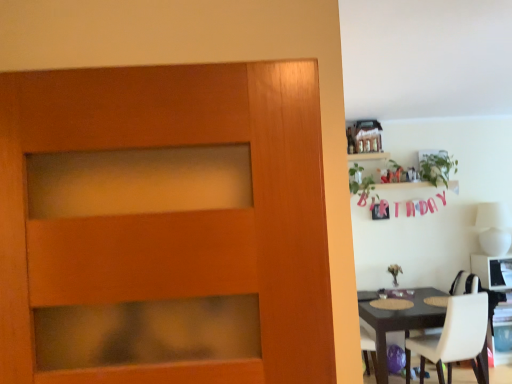
This screenshot has height=384, width=512. Describe the element at coordinates (360, 184) in the screenshot. I see `green leafy plant at upper right, which is the first plant in left-to-right order` at that location.

Where is `green leafy plant at upper right, which is counted as the first plant, starting from the right`? Image resolution: width=512 pixels, height=384 pixels. green leafy plant at upper right, which is counted as the first plant, starting from the right is located at coordinates (437, 168).

At what (x,y) coordinates should I click in order to perform the action: click on computer desk located underneath the green leafy plant at upper right, which is the 2th plant from left to right (from a real-world perspective). Please return your answer as a coordinate pair (x, y). Looking at the image, I should click on (501, 303).

Considering the sizes of objects green leafy plant at upper right, which is counted as the first plant, starting from the right, and white glossy computer desk at right in the image provided, who is thinner, green leafy plant at upper right, which is counted as the first plant, starting from the right, or white glossy computer desk at right?

green leafy plant at upper right, which is counted as the first plant, starting from the right.

Could white glossy computer desk at right be considered to be inside green leafy plant at upper right, which is counted as the first plant, starting from the right?

That's incorrect, white glossy computer desk at right is not inside green leafy plant at upper right, which is counted as the first plant, starting from the right.

Considering the points (454, 168) and (482, 263), which point is in front, point (454, 168) or point (482, 263)?

The point (482, 263) is in front.

Considering the points (438, 308) and (366, 183), which point is in front, point (438, 308) or point (366, 183)?

The point (438, 308) is closer to the camera.

Can you confirm if matte brown table at right is wider than green leafy plant at upper right, positioned as the 2th plant in right-to-left order?

Yes, matte brown table at right is wider than green leafy plant at upper right, positioned as the 2th plant in right-to-left order.

Where is `round table on the right side of green leafy plant at upper right, which is the first plant in left-to-right order`? The width and height of the screenshot is (512, 384). round table on the right side of green leafy plant at upper right, which is the first plant in left-to-right order is located at coordinates (401, 322).

Is matte brown table at right smaller than green leafy plant at upper right, which is the first plant in left-to-right order?

No.

Is point (504, 357) positioned in front of point (447, 343)?

No, it is behind (447, 343).

Does white glossy computer desk at right lie behind white leather chair at lower right?

Yes, the depth of white glossy computer desk at right is greater than that of white leather chair at lower right.

Considering the positions of objects white glossy computer desk at right and white leather chair at lower right in the image provided, who is more to the right, white glossy computer desk at right or white leather chair at lower right?

Positioned to the right is white glossy computer desk at right.

What are the coordinates of `computer desk above the white leather chair at lower right (from a real-world perspective)` in the screenshot? It's located at (501, 303).

This screenshot has height=384, width=512. Find the location of `chair that appears in front of the wooden shelf at upper right`. chair that appears in front of the wooden shelf at upper right is located at coordinates (454, 337).

Is white leather chair at lower right aimed at wooden shelf at upper right?

No, white leather chair at lower right does not turn towards wooden shelf at upper right.

Does white leather chair at lower right come behind wooden shelf at upper right?

No, white leather chair at lower right is closer to the camera.

Can you tell me how much white leather chair at lower right and wooden shelf at upper right differ in facing direction?

The facing directions of white leather chair at lower right and wooden shelf at upper right are 171 degrees apart.

Is wooden shelf at upper right positioned behind white glossy computer desk at right?

No, wooden shelf at upper right is closer to the viewer.

Which of these two, wooden shelf at upper right or white glossy computer desk at right, stands shorter?

wooden shelf at upper right.

From the image's perspective, which one is positioned higher, wooden shelf at upper right or white glossy computer desk at right?

wooden shelf at upper right.

From the image's perspective, would you say white leather chair at lower right is shown under green leafy plant at upper right, which is the first plant in left-to-right order?

Yes, from the image's perspective, white leather chair at lower right is below green leafy plant at upper right, which is the first plant in left-to-right order.

Could you measure the distance between white leather chair at lower right and green leafy plant at upper right, which is the first plant in left-to-right order?

white leather chair at lower right is 1.46 meters from green leafy plant at upper right, which is the first plant in left-to-right order.

Which of these two, white leather chair at lower right or green leafy plant at upper right, positioned as the 2th plant in right-to-left order, stands taller?

white leather chair at lower right.

Looking at this image, is white leather chair at lower right beside green leafy plant at upper right, which is the first plant in left-to-right order?

No.

Is white glossy computer desk at right beside wooden shelf at upper right?

No.

Considering the points (502, 317) and (382, 154), which point is in front, point (502, 317) or point (382, 154)?

The point (502, 317) is closer to the camera.

Which object is closer to the camera, white glossy computer desk at right or wooden shelf at upper right?

Positioned in front is wooden shelf at upper right.

Based on the photo, from a real-world perspective, is white glossy computer desk at right located higher than wooden shelf at upper right?

Incorrect, from a real-world perspective, white glossy computer desk at right is lower than wooden shelf at upper right.

From the image's perspective, which plant is the 2nd one above the white glossy computer desk at right? Please provide its 2D coordinates.

[(437, 168)]

In order to click on the 1st plant directly above the matte brown table at right (from a real-world perspective) in this screenshot , I will do `click(360, 184)`.

Looking at the image, which one is located closer to green leafy plant at upper right, which is counted as the first plant, starting from the right, white glossy computer desk at right or matte brown table at right?

white glossy computer desk at right is positioned closer to the anchor green leafy plant at upper right, which is counted as the first plant, starting from the right.

Looking at the image, which one is located closer to matte brown table at right, wooden shelf at upper right or green leafy plant at upper right, which is counted as the first plant, starting from the right?

green leafy plant at upper right, which is counted as the first plant, starting from the right.

Considering their positions, is green leafy plant at upper right, which is the first plant in left-to-right order, positioned further to green leafy plant at upper right, which is the 2th plant from left to right, than matte brown table at right?

Among the two, matte brown table at right is located further to green leafy plant at upper right, which is the 2th plant from left to right.

Considering their positions, is matte brown table at right positioned closer to green leafy plant at upper right, which is the first plant in left-to-right order, than green leafy plant at upper right, which is the 2th plant from left to right?

green leafy plant at upper right, which is the 2th plant from left to right, is positioned closer to the anchor green leafy plant at upper right, which is the first plant in left-to-right order.

Estimate the real-world distances between objects in this image. Which object is further from green leafy plant at upper right, which is the 2th plant from left to right, green leafy plant at upper right, positioned as the 2th plant in right-to-left order, or wooden shelf at upper right?

The object further to green leafy plant at upper right, which is the 2th plant from left to right, is green leafy plant at upper right, positioned as the 2th plant in right-to-left order.

When comparing their distances from wooden shelf at upper right, does green leafy plant at upper right, positioned as the 2th plant in right-to-left order, or green leafy plant at upper right, which is counted as the first plant, starting from the right, seem closer?

The object closer to wooden shelf at upper right is green leafy plant at upper right, positioned as the 2th plant in right-to-left order.

Based on their spatial positions, is matte brown table at right or green leafy plant at upper right, which is the first plant in left-to-right order, closer to wooden shelf at upper right?

Among the two, green leafy plant at upper right, which is the first plant in left-to-right order, is located nearer to wooden shelf at upper right.

Estimate the real-world distances between objects in this image. Which object is closer to white leather chair at lower right, matte brown table at right or green leafy plant at upper right, positioned as the 2th plant in right-to-left order?

matte brown table at right lies closer to white leather chair at lower right than the other object.

At what (x,y) coordinates should I click in order to perform the action: click on chair between matte brown table at right and white glossy computer desk at right. Please return your answer as a coordinate pair (x, y). Looking at the image, I should click on (454, 337).

Locate an element on the screen. This screenshot has width=512, height=384. shelf located between green leafy plant at upper right, positioned as the 2th plant in right-to-left order, and white glossy computer desk at right in the left-right direction is located at coordinates (368, 156).

The image size is (512, 384). Identify the location of shelf between green leafy plant at upper right, positioned as the 2th plant in right-to-left order, and green leafy plant at upper right, which is counted as the first plant, starting from the right. (368, 156).

Locate an element on the screen. The image size is (512, 384). computer desk that lies between green leafy plant at upper right, which is the 2th plant from left to right, and white leather chair at lower right from top to bottom is located at coordinates (501, 303).